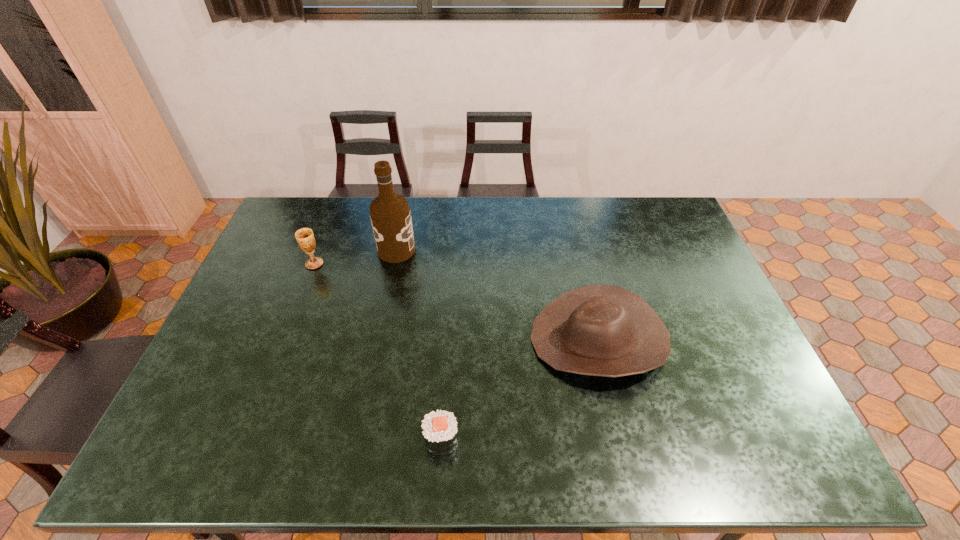
Choose which object is the third nearest neighbor to the second object from right to left. Please provide its 2D coordinates. Your answer should be formatted as a tuple, i.e. [(x, y)], where the tuple contains the x and y coordinates of a point satisfying the conditions above.

[(304, 236)]

This screenshot has width=960, height=540. In order to click on free location that satisfies the following two spatial constraints: 1. on the label of the sushi; 2. on the right side of the tallest object in this screenshot , I will do `click(358, 440)`.

Locate an element on the screen. vacant space that satisfies the following two spatial constraints: 1. on the front side of the chalice; 2. on the left side of the cowboy hat is located at coordinates (285, 340).

You are a GUI agent. You are given a task and a screenshot of the screen. Output one action in this format:
    pyautogui.click(x=<x>, y=<y>)
    Task: Click on the blank space that satisfies the following two spatial constraints: 1. on the label of the third object from right to left; 2. on the left side of the third object from left to right
    The width and height of the screenshot is (960, 540).
    Given the screenshot: What is the action you would take?
    pyautogui.click(x=358, y=440)

I want to click on blank area in the image that satisfies the following two spatial constraints: 1. on the label of the second object from left to right; 2. on the back side of the second nearest object, so click(x=378, y=340).

Where is `vacant area that satisfies the following two spatial constraints: 1. on the back side of the second nearest object; 2. on the label of the tallest object`? This screenshot has height=540, width=960. vacant area that satisfies the following two spatial constraints: 1. on the back side of the second nearest object; 2. on the label of the tallest object is located at coordinates (577, 250).

Locate an element on the screen. vacant space that satisfies the following two spatial constraints: 1. on the label of the second object from left to right; 2. on the back side of the sushi is located at coordinates (358, 440).

This screenshot has width=960, height=540. I want to click on vacant position in the image that satisfies the following two spatial constraints: 1. on the back side of the third farthest object; 2. on the label of the alcohol, so click(x=577, y=250).